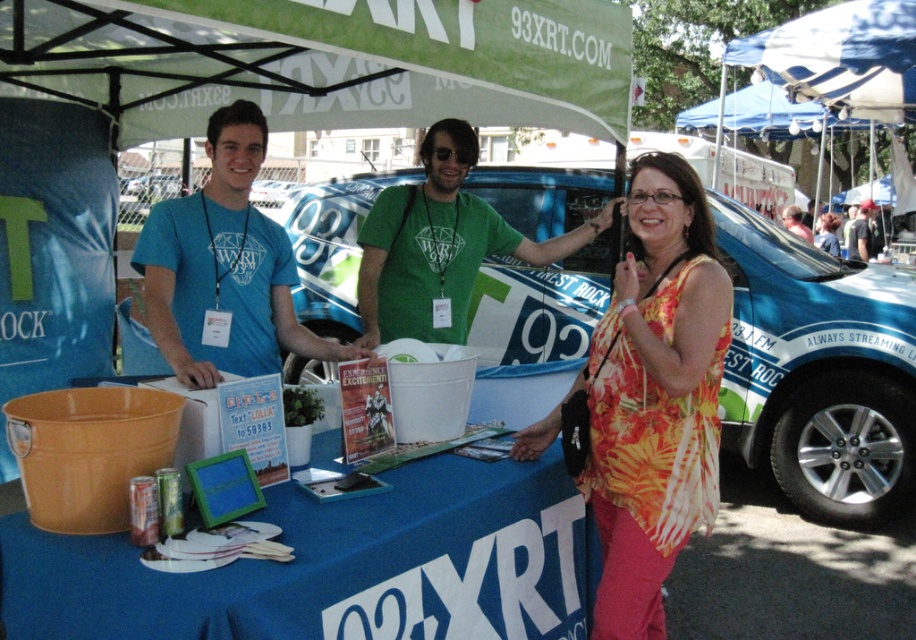
Question: Which point is closer to the camera?

Choices:
 (A) (315, 115)
 (B) (1, 531)

Answer: (B)

Question: Is floral print tank top at center further to camera compared to matte blue t-shirt at center?

Choices:
 (A) no
 (B) yes

Answer: (A)

Question: Which object is closer to the camera taking this photo?

Choices:
 (A) blue fabric tablecloth at center
 (B) green matte shirt at center

Answer: (A)

Question: Is the position of floral print tank top at center more distant than that of matte blue t-shirt at center?

Choices:
 (A) yes
 (B) no

Answer: (B)

Question: Observing the image, what is the correct spatial positioning of floral print tank top at center in reference to green cotton shirt at center?

Choices:
 (A) below
 (B) above

Answer: (A)

Question: Estimate the real-world distances between objects in this image. Which object is farther from the matte blue t-shirt at center?

Choices:
 (A) blue fabric tablecloth at center
 (B) green cotton shirt at center
 (C) green matte shirt at center
 (D) floral print tank top at center

Answer: (B)